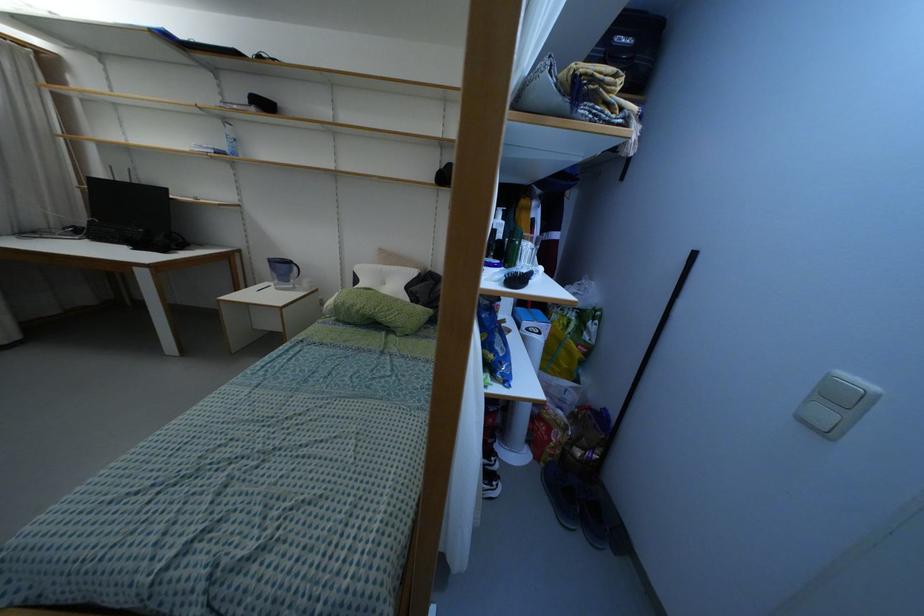
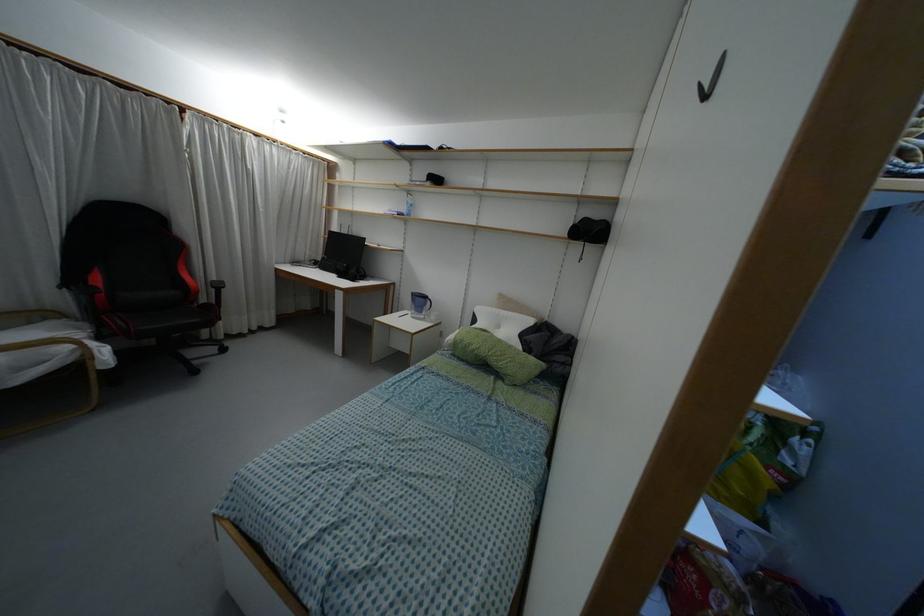
Question: Which direction would the cameraman need to move to produce the second image? Reply with the corresponding letter.

Choices:
 (A) Left
 (B) Right
 (C) Forward
 (D) Backward

Answer: (A)